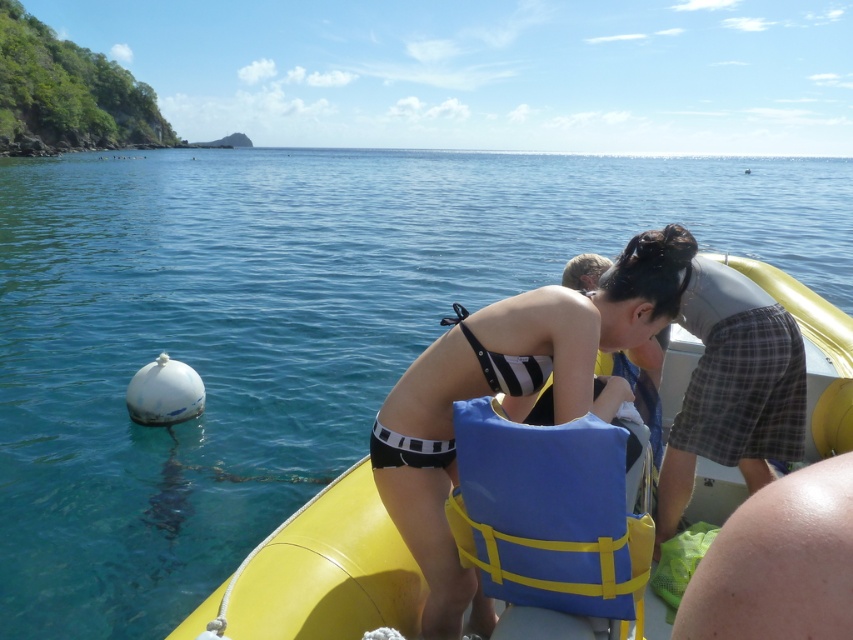
Is black striped bikini at center to the right of blue fabric life jacket at center from the viewer's perspective?

Yes, black striped bikini at center is to the right of blue fabric life jacket at center.

In order to click on black striped bikini at center in this screenshot , I will do `click(509, 397)`.

Does point (646, 320) come closer to viewer compared to point (607, 488)?

No, it is not.

Identify the location of black striped bikini at center. This screenshot has height=640, width=853. (509, 397).